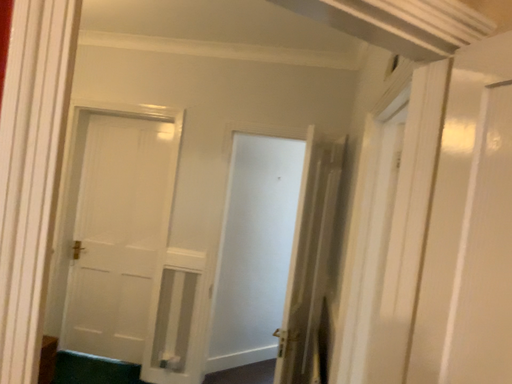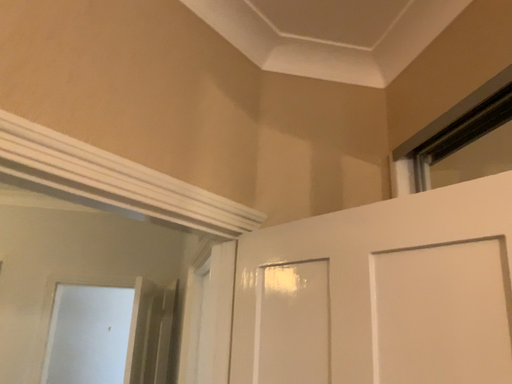
Question: How did the camera likely rotate when shooting the video?

Choices:
 (A) rotated upward
 (B) rotated downward

Answer: (A)